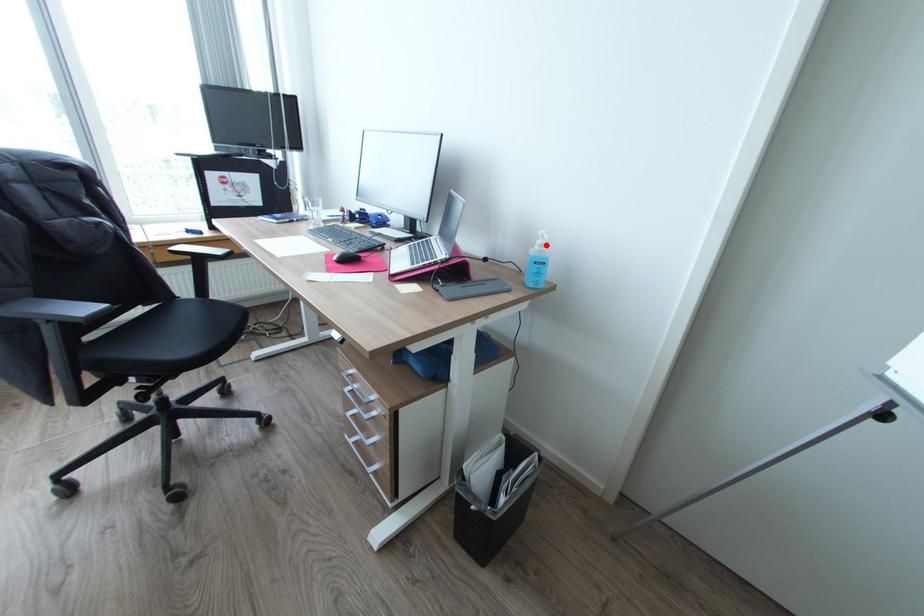
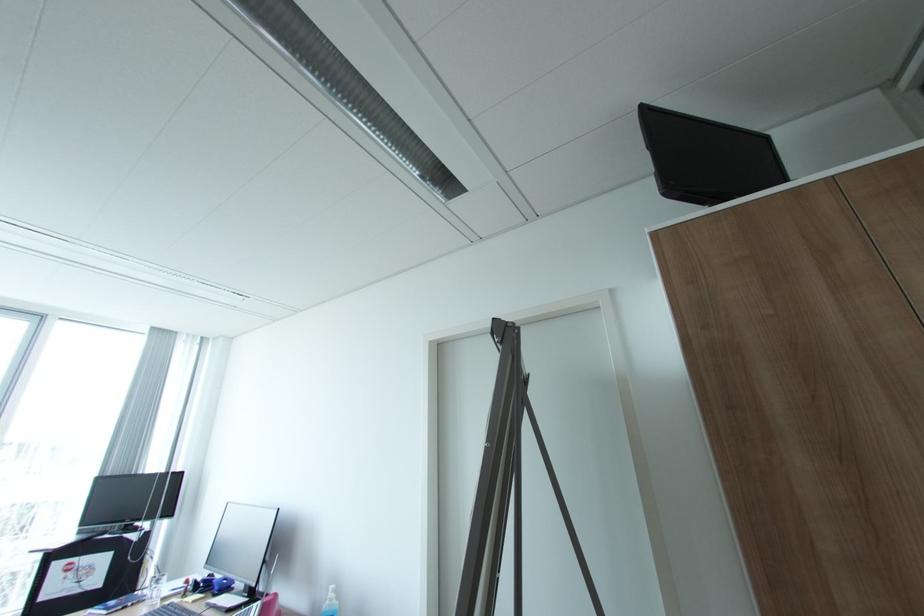
Find the pixel in the second image that matches the highlighted location in the first image.

(336, 599)